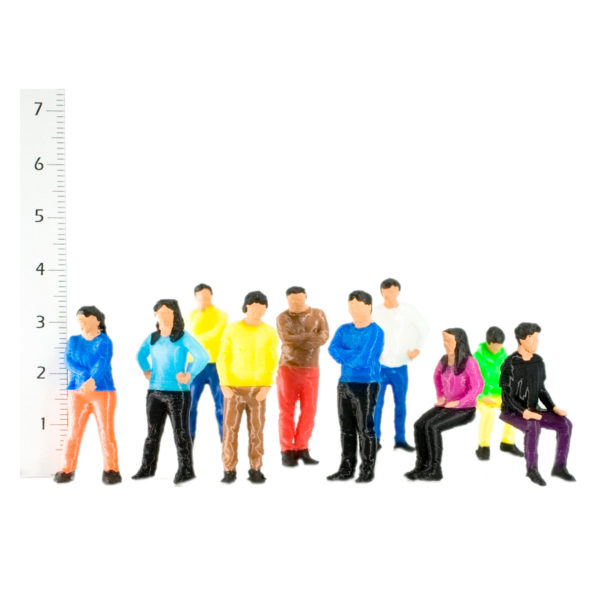
You are a GUI agent. You are given a task and a screenshot of the screen. Output one action in this format:
    pyautogui.click(x=<x>, y=<y>)
    Task: Click on the people figurines
    
    Given the screenshot: What is the action you would take?
    pyautogui.click(x=92, y=366), pyautogui.click(x=168, y=359), pyautogui.click(x=200, y=326), pyautogui.click(x=245, y=346), pyautogui.click(x=300, y=331), pyautogui.click(x=357, y=341), pyautogui.click(x=391, y=315), pyautogui.click(x=455, y=371), pyautogui.click(x=488, y=368), pyautogui.click(x=524, y=376)